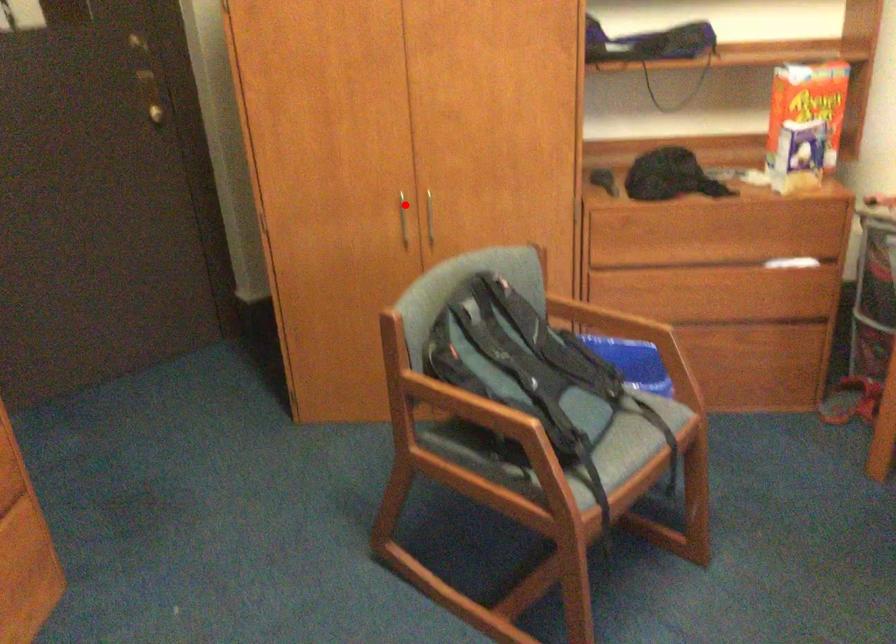
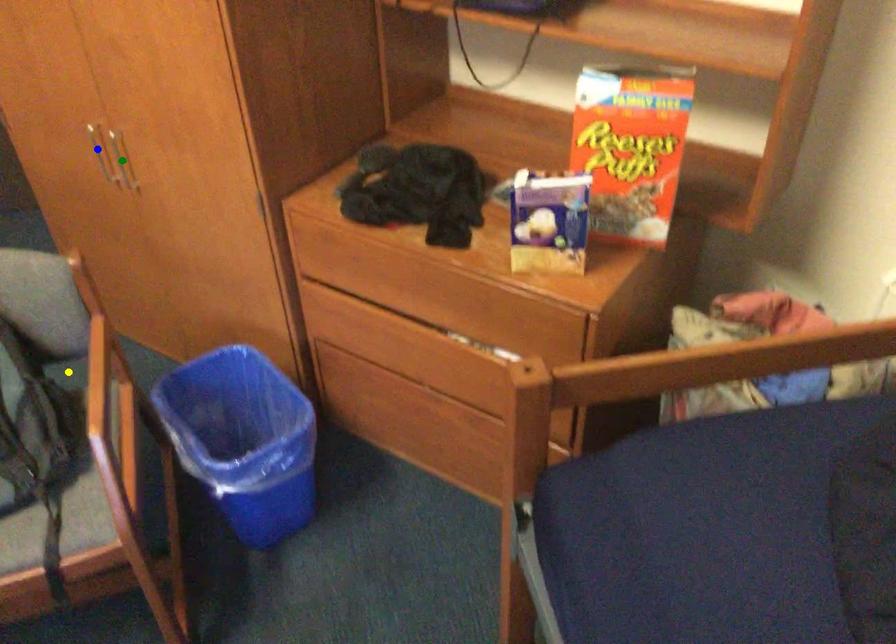
Question: I am providing you with two images of the same scene from different viewpoints. A red point is marked on the first image. You are given multiple points on the second image. Can you choose the point in image 2 that corresponds to the point in image 1?

Choices:
 (A) green point
 (B) yellow point
 (C) blue point

Answer: (C)